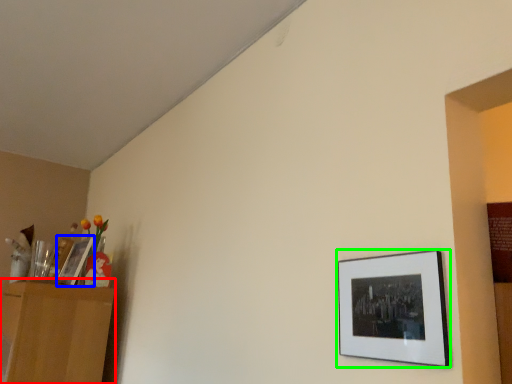
Question: Based on their relative distances, which object is nearer to dresser (highlighted by a red box)? Choose from picture frame (highlighted by a blue box) and picture frame (highlighted by a green box).

Choices:
 (A) picture frame
 (B) picture frame

Answer: (A)